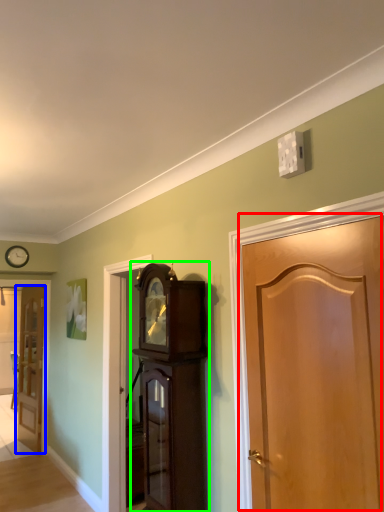
Question: Estimate the real-world distances between objects in this image. Which object is closer to door (highlighted by a red box), door (highlighted by a blue box) or cabinetry (highlighted by a green box)?

Choices:
 (A) door
 (B) cabinetry

Answer: (B)